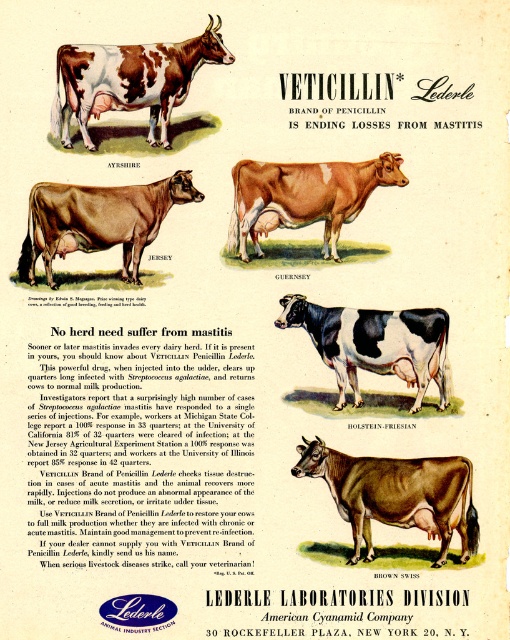
Question: Which of the following is the farthest from the observer?

Choices:
 (A) black and white holstein-friesian at center
 (B) brown glossy cow at center
 (C) brown spotted cow at center

Answer: (C)

Question: Is brown spotted cow at center thinner than brown glossy jersey cow at center?

Choices:
 (A) yes
 (B) no

Answer: (B)

Question: Among these points, which one is nearest to the camera?

Choices:
 (A) (81, 193)
 (B) (446, 356)
 (C) (63, 129)
 (D) (245, 218)

Answer: (A)

Question: Which point appears farthest from the camera in this image?

Choices:
 (A) (452, 515)
 (B) (182, 202)
 (C) (175, 93)
 (D) (363, 401)

Answer: (C)

Question: Is brown glossy holstein-friesian at center wider than brown spotted cow at center?

Choices:
 (A) no
 (B) yes

Answer: (A)

Question: Is brown glossy holstein-friesian at center to the right of brown glossy jersey cow at center from the viewer's perspective?

Choices:
 (A) yes
 (B) no

Answer: (A)